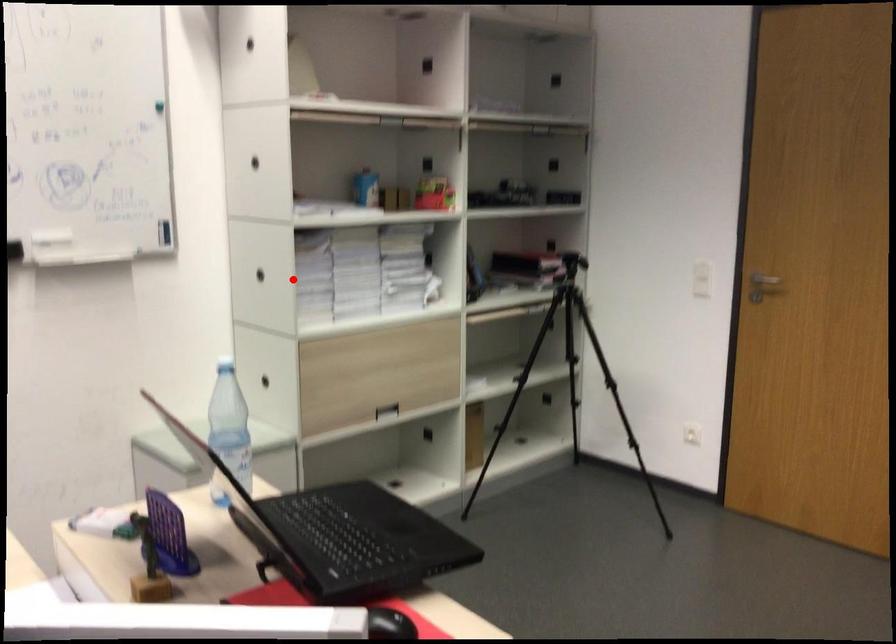
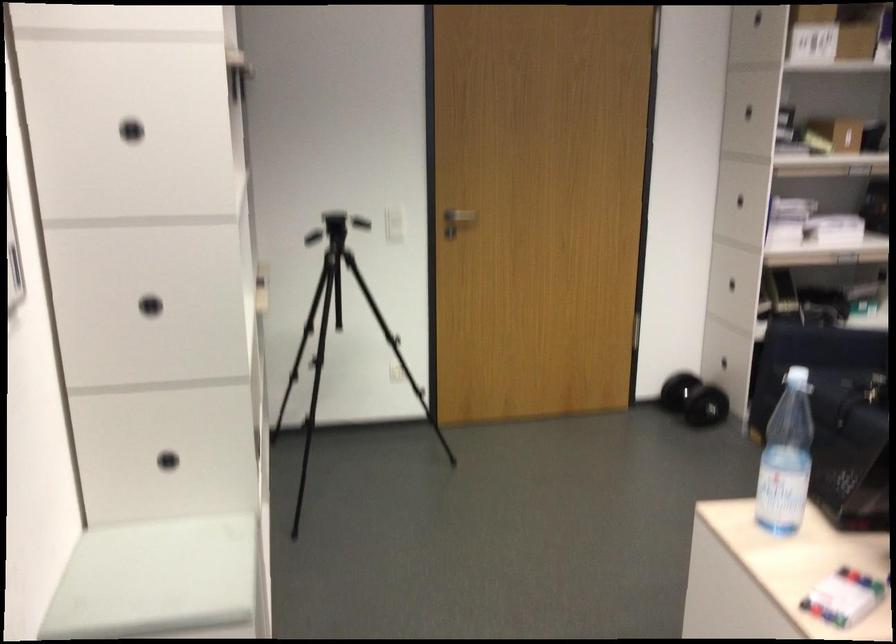
Question: I am providing you with two images of the same scene from different viewpoints. Given a red point in image1, look at the same physical point in image2. Is it:

Choices:
 (A) Closer to the viewpoint
 (B) Farther from the viewpoint

Answer: (A)